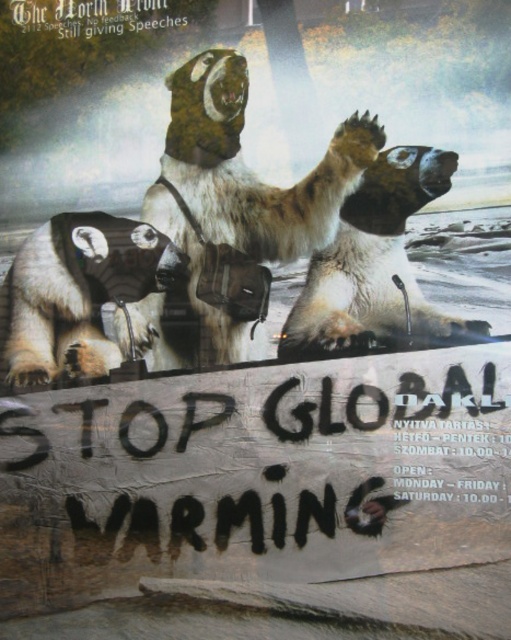
Question: Is fur-covered polar bear at center above white fur polar bear at lower left?

Choices:
 (A) yes
 (B) no

Answer: (A)

Question: Which of these objects is positioned closest to the white fur polar bear at lower left?

Choices:
 (A) fur-covered polar bear at center
 (B) furry white bear at center

Answer: (B)

Question: Which point is farther from the camera taking this photo?

Choices:
 (A) (469, 404)
 (B) (328, 260)

Answer: (B)

Question: Considering the relative positions of furry white bear at center and fur-covered polar bear at center in the image provided, where is furry white bear at center located with respect to fur-covered polar bear at center?

Choices:
 (A) right
 (B) left

Answer: (B)

Question: Does wooden signboard at center have a smaller size compared to white fur polar bear at lower left?

Choices:
 (A) no
 (B) yes

Answer: (A)

Question: Which point is farther to the camera?

Choices:
 (A) fur-covered polar bear at center
 (B) white fur polar bear at lower left
 (C) furry white bear at center
 (D) wooden signboard at center

Answer: (B)